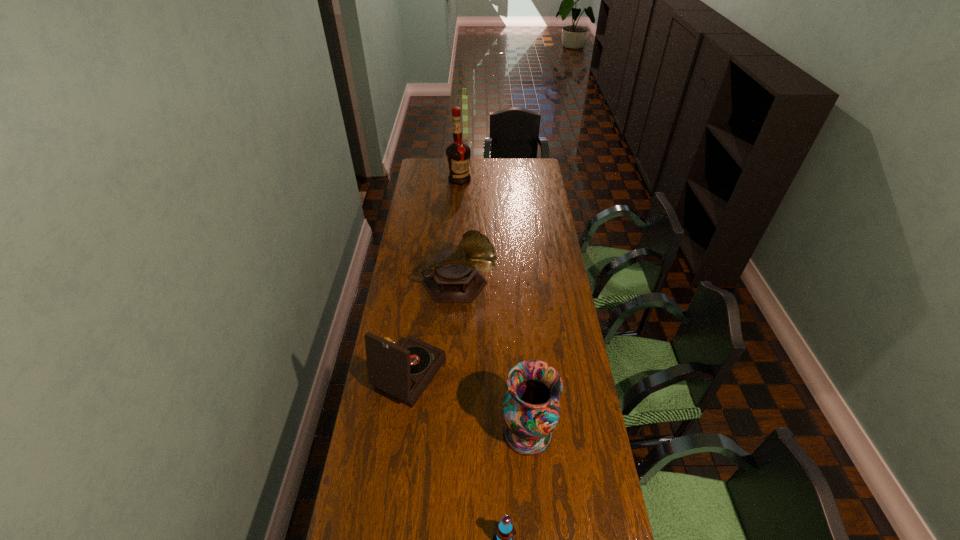
You are a GUI agent. You are given a task and a screenshot of the screen. Output one action in this format:
    pyautogui.click(x=<x>, y=<y>)
    Task: Click on the tallest object
    Image resolution: width=960 pixels, height=540 pixels.
    Given the screenshot: What is the action you would take?
    pyautogui.click(x=458, y=154)

Find the location of a particular element. The image size is (960, 540). liquor is located at coordinates (458, 154).

Where is `the farther phonograph record`? the farther phonograph record is located at coordinates (454, 277).

Find the location of a particular element. The width and height of the screenshot is (960, 540). vase is located at coordinates (531, 409).

At what (x,y) coordinates should I click in order to perform the action: click on the nearer phonograph record. Please return your answer as a coordinate pair (x, y). Image resolution: width=960 pixels, height=540 pixels. Looking at the image, I should click on (403, 372).

You are a GUI agent. You are given a task and a screenshot of the screen. Output one action in this format:
    pyautogui.click(x=<x>, y=<y>)
    Task: Click on the vacant area located on the front and back of the farthest object
    
    Given the screenshot: What is the action you would take?
    pyautogui.click(x=457, y=217)

Where is `free space located on the horn direction of the farther phonograph record`? This screenshot has width=960, height=540. free space located on the horn direction of the farther phonograph record is located at coordinates (529, 286).

Locate an element on the screen. The width and height of the screenshot is (960, 540). free spot located 0.180m on the front of the vase is located at coordinates (535, 523).

The width and height of the screenshot is (960, 540). Identify the location of vacant space located 0.070m on the back of the nearer phonograph record. (416, 329).

Locate an element on the screen. object present at the far edge is located at coordinates (458, 154).